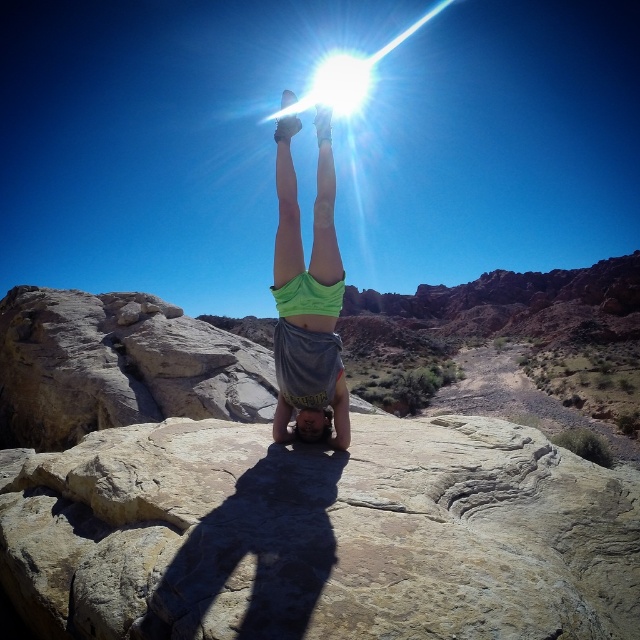
You are a photographer trying to capture the perfect shot of the person doing a handstand. You notice the smooth beige rock at center and the green fabric at center. Which object should you focus on first if you want to ensure both are in the frame without moving the camera?

The smooth beige rock at center is not as tall as the green fabric at center, so you should focus on the taller green fabric at center first to ensure it fits within the frame.

You are a photographer trying to capture the perfect shot of the handstand performer. You notice two points in the image labeled as point (460,592) and point (307,268). If you want to focus on the point that is closer to the camera, which one should you choose?

Point (460,592) is in front of point (307,268), so you should focus on point (460,592) to capture the one closer to the camera.